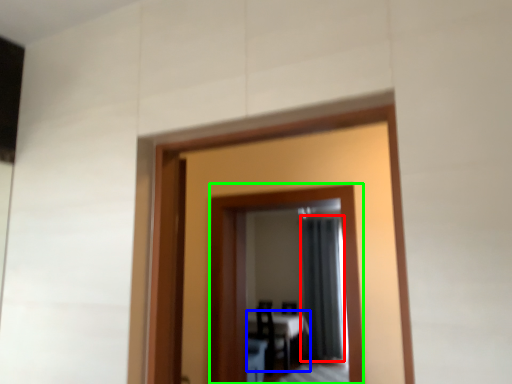
Question: Estimate the real-world distances between objects in this image. Which object is closer to curtain (highlighted by a red box), table (highlighted by a blue box) or mirror (highlighted by a green box)?

Choices:
 (A) table
 (B) mirror

Answer: (A)